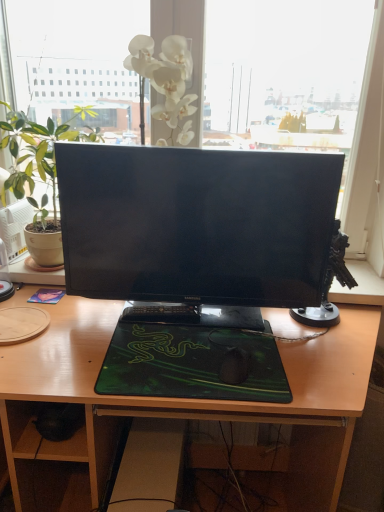
You are a GUI agent. You are given a task and a screenshot of the screen. Output one action in this format:
    pyautogui.click(x=<x>, y=<y>)
    Task: Click on the free space in front of black plastic keyboard at center
    
    Given the screenshot: What is the action you would take?
    pyautogui.click(x=158, y=349)